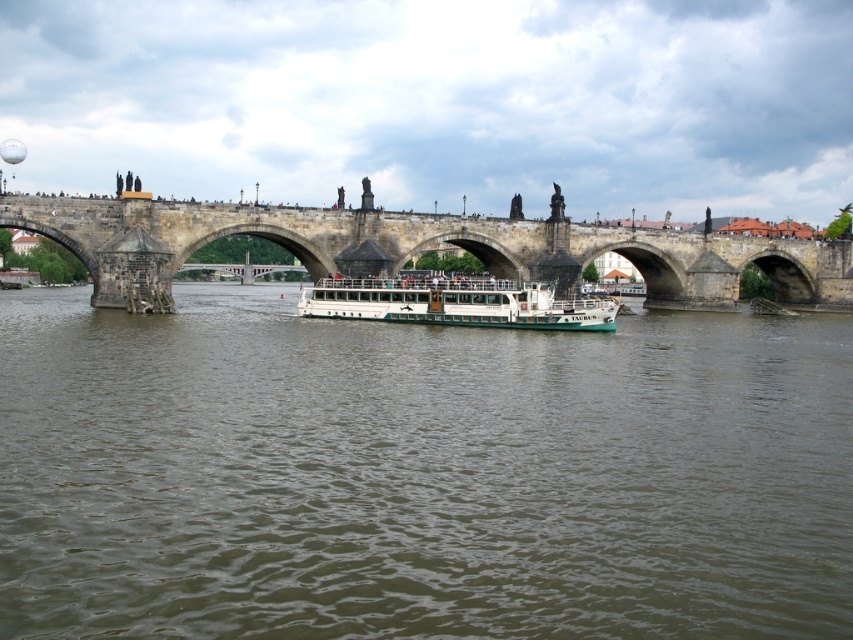
Question: Which point is closer to the camera?

Choices:
 (A) white matte boat at center
 (B) stone bridge at center
 (C) brown water at center

Answer: (C)

Question: Which point appears farthest from the camera in this image?

Choices:
 (A) (0, 580)
 (B) (491, 316)

Answer: (B)

Question: Does stone bridge at center have a smaller size compared to white matte boat at center?

Choices:
 (A) yes
 (B) no

Answer: (B)

Question: Does brown water at center appear over white matte boat at center?

Choices:
 (A) yes
 (B) no

Answer: (B)

Question: Does stone bridge at center have a smaller size compared to white matte boat at center?

Choices:
 (A) yes
 (B) no

Answer: (B)

Question: Which of the following is the closest to the observer?

Choices:
 (A) (747, 419)
 (B) (508, 291)

Answer: (A)